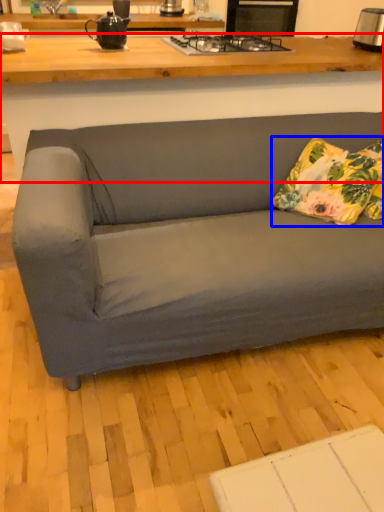
Question: Which object appears closest to the camera in this image, desk (highlighted by a red box) or pillow (highlighted by a blue box)?

Choices:
 (A) desk
 (B) pillow

Answer: (A)